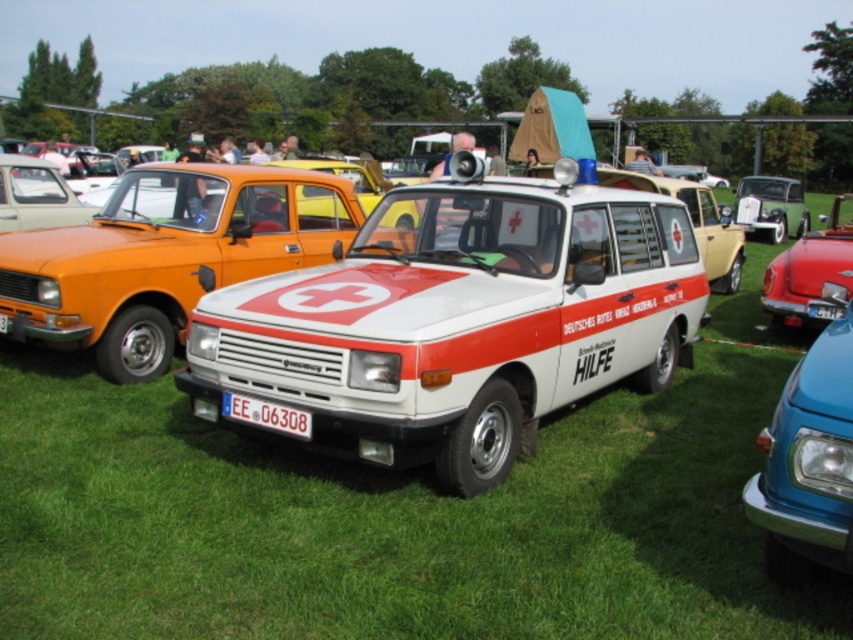
Describe the element at coordinates (265, 413) in the screenshot. I see `white plastic license plate at center` at that location.

Measure the distance between white plastic license plate at center and camera.

white plastic license plate at center is 4.17 meters away from camera.

Locate an element on the screen. white plastic license plate at center is located at coordinates tap(265, 413).

Can you confirm if white matte van at center is bigger than metallic silver car at center?

No.

Does white matte van at center come in front of metallic silver car at center?

Yes, white matte van at center is closer to the viewer.

Who is more forward, (648, 337) or (738, 196)?

Point (648, 337) is more forward.

This screenshot has height=640, width=853. In order to click on white matte van at center in this screenshot , I will do `click(459, 321)`.

Does shiny red car at right appear on the right side of transparent plastic line at center?

Yes, shiny red car at right is to the right of transparent plastic line at center.

Is shiny red car at right positioned before transparent plastic line at center?

No, it is behind transparent plastic line at center.

Does point (811, 246) come closer to viewer compared to point (780, 346)?

No, (811, 246) is behind (780, 346).

You are a GUI agent. You are given a task and a screenshot of the screen. Output one action in this format:
    pyautogui.click(x=<x>, y=<y>)
    Task: Click on the shiny red car at right
    
    Given the screenshot: What is the action you would take?
    pyautogui.click(x=811, y=275)